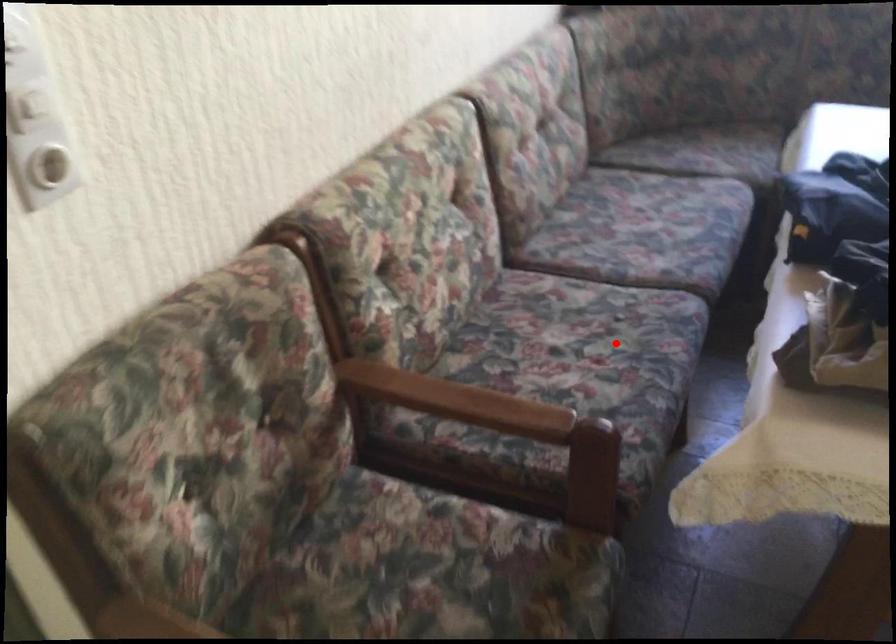
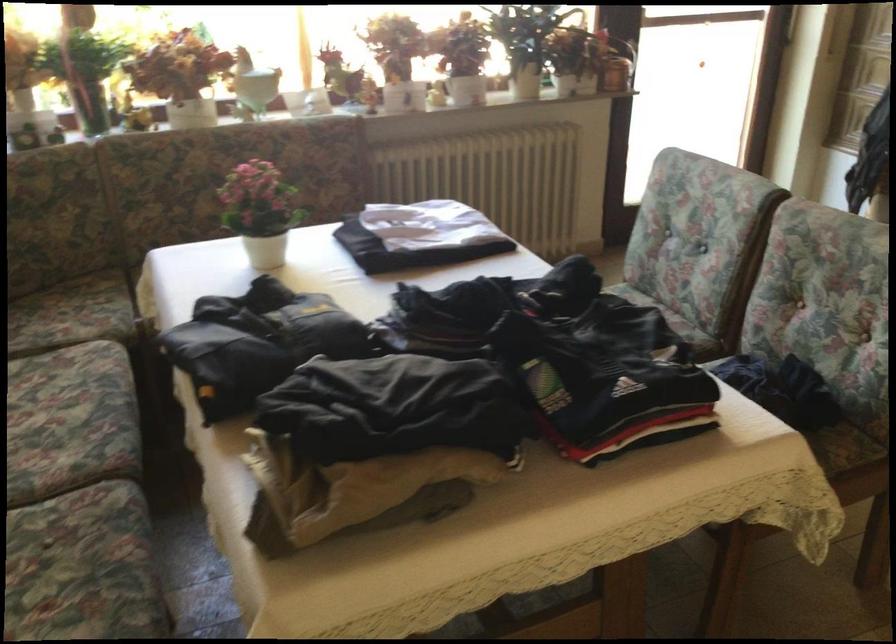
Question: I am providing you with two images of the same scene from different viewpoints. A red point is shown in image1. For the corresponding object point in image2, is it positioned nearer or farther from the camera?

Choices:
 (A) Nearer
 (B) Farther

Answer: (A)